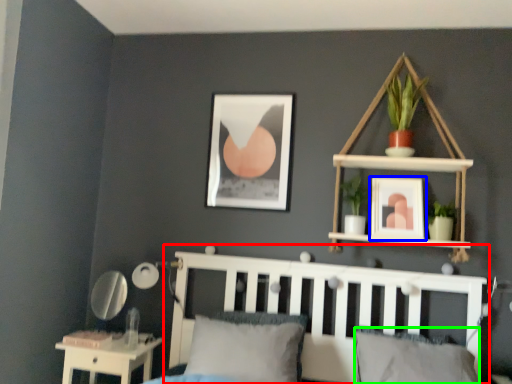
Question: Estimate the real-world distances between objects in this image. Which object is farther from bed frame (highlighted by a red box), picture frame (highlighted by a blue box) or pillow (highlighted by a green box)?

Choices:
 (A) picture frame
 (B) pillow

Answer: (A)